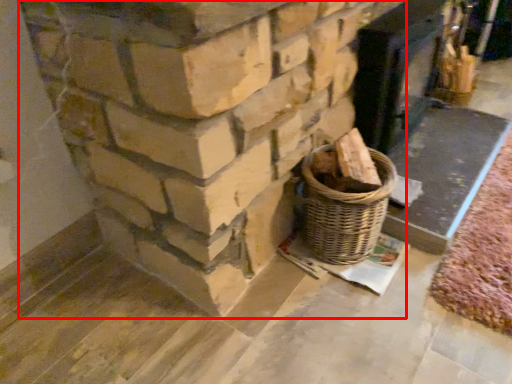
Question: In this image, where is fireplace (annotated by the red box) located relative to fireplace?

Choices:
 (A) right
 (B) left

Answer: (B)